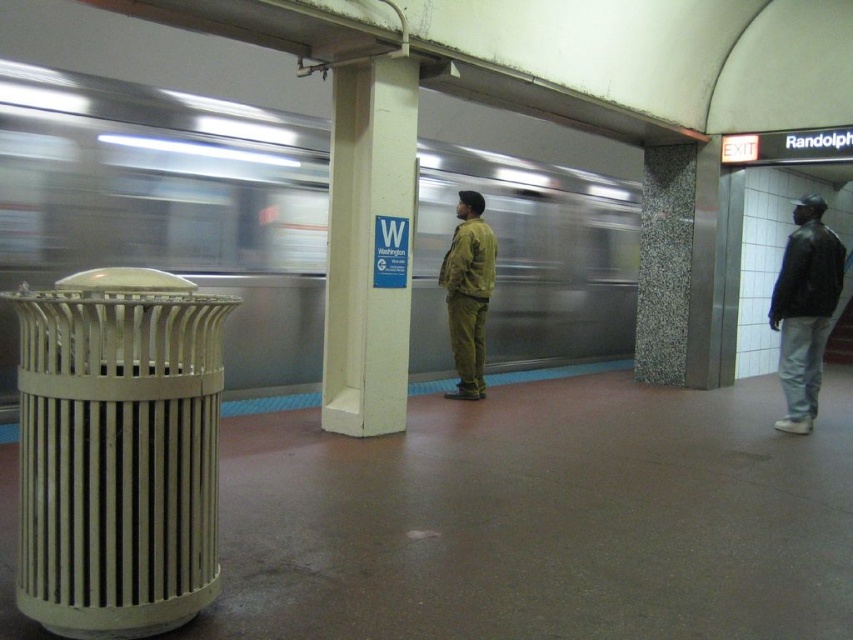
Question: Where is granite pillar at center located in relation to green matte jacket at center in the image?

Choices:
 (A) left
 (B) right

Answer: (B)

Question: Among these objects, which one is farthest from the camera?

Choices:
 (A) granite pillar at center
 (B) metallic silver train at center

Answer: (A)

Question: Which object appears closest to the camera in this image?

Choices:
 (A) metallic silver train at center
 (B) white concrete pillar at center
 (C) granite pillar at center
 (D) black leather jacket at right

Answer: (B)

Question: Does metallic silver train at center have a smaller size compared to black leather jacket at right?

Choices:
 (A) yes
 (B) no

Answer: (B)

Question: Which point appears closest to the camera in this image?

Choices:
 (A) (683, 244)
 (B) (840, 269)

Answer: (B)

Question: Is granite pillar at center positioned behind black leather jacket at right?

Choices:
 (A) yes
 (B) no

Answer: (A)